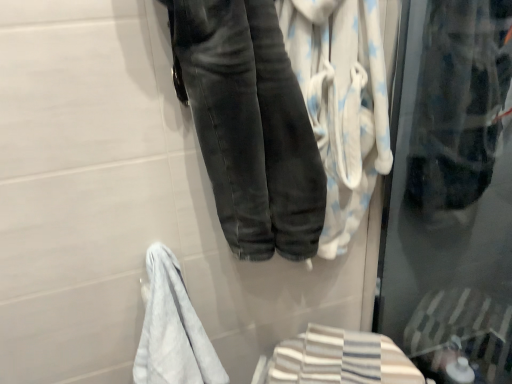
What do you see at coordinates (250, 126) in the screenshot?
I see `dark gray denim jeans at center` at bounding box center [250, 126].

This screenshot has width=512, height=384. What do you see at coordinates (342, 102) in the screenshot?
I see `white soft towel at center, the 1th bath towel viewed from the top` at bounding box center [342, 102].

Where is `striped cotton bath towel at lower right, the first bath towel in the bottom-to-top sequence`? striped cotton bath towel at lower right, the first bath towel in the bottom-to-top sequence is located at coordinates (327, 357).

Would you say dark gray denim jeans at center is a long distance from white soft towel at center, positioned as the 2th bath towel in bottom-to-top order?

No.

Consider the image. Considering the sizes of dark gray denim jeans at center and white soft towel at center, the 1th bath towel viewed from the top, in the image, is dark gray denim jeans at center bigger or smaller than white soft towel at center, the 1th bath towel viewed from the top,?

In the image, dark gray denim jeans at center appears to be larger than white soft towel at center, the 1th bath towel viewed from the top.

Is dark gray denim jeans at center oriented away from white soft towel at center, positioned as the 2th bath towel in bottom-to-top order?

dark gray denim jeans at center is not turned away from white soft towel at center, positioned as the 2th bath towel in bottom-to-top order.

Between dark gray denim jeans at center and white soft towel at center, the 1th bath towel viewed from the top, which one has less height?

Standing shorter between the two is dark gray denim jeans at center.

In the scene shown: From a real-world perspective, is dark gray denim jeans at center below white soft towel at lower left?

No, from a real-world perspective, dark gray denim jeans at center is not under white soft towel at lower left.

Can you confirm if dark gray denim jeans at center is bigger than white soft towel at lower left?

Correct, dark gray denim jeans at center is larger in size than white soft towel at lower left.

Does dark gray denim jeans at center turn towards white soft towel at lower left?

No, dark gray denim jeans at center is not facing towards white soft towel at lower left.

Is white soft towel at lower left next to dark gray denim jeans at center?

They are not placed beside each other.

From a real-world perspective, is white soft towel at lower left under dark gray denim jeans at center?

Indeed, from a real-world perspective, white soft towel at lower left is positioned beneath dark gray denim jeans at center.

Considering the relative sizes of white soft towel at lower left and dark gray denim jeans at center in the image provided, is white soft towel at lower left wider than dark gray denim jeans at center?

No, white soft towel at lower left is not wider than dark gray denim jeans at center.

What's the angular difference between white soft towel at lower left and dark gray denim jeans at center's facing directions?

They differ by 2.61 degrees in their facing directions.

Is striped cotton bath towel at lower right, the first bath towel in the bottom-to-top sequence, to the right of dark gray denim jeans at center from the viewer's perspective?

Yes.

Is dark gray denim jeans at center at the back of striped cotton bath towel at lower right, the first bath towel in the bottom-to-top sequence?

No, striped cotton bath towel at lower right, the first bath towel in the bottom-to-top sequence, is not facing the opposite direction of dark gray denim jeans at center.

This screenshot has width=512, height=384. Find the location of `trousers that appears in front of the striped cotton bath towel at lower right, the first bath towel in the bottom-to-top sequence`. trousers that appears in front of the striped cotton bath towel at lower right, the first bath towel in the bottom-to-top sequence is located at coordinates (250, 126).

Considering the sizes of objects striped cotton bath towel at lower right, which ranks as the 2th bath towel in top-to-bottom order, and dark gray denim jeans at center in the image provided, who is taller, striped cotton bath towel at lower right, which ranks as the 2th bath towel in top-to-bottom order, or dark gray denim jeans at center?

With more height is dark gray denim jeans at center.

Which bath towel is the 1st one when counting from the right side of the dark gray denim jeans at center? Please provide its 2D coordinates.

[(342, 102)]

Is point (297, 67) positioned after point (239, 29)?

That is True.

How distant is white soft towel at center, the 1th bath towel viewed from the top, from dark gray denim jeans at center?

The distance of white soft towel at center, the 1th bath towel viewed from the top, from dark gray denim jeans at center is 5.90 inches.

Is white soft towel at center, positioned as the 2th bath towel in bottom-to-top order, looking in the opposite direction of dark gray denim jeans at center?

white soft towel at center, positioned as the 2th bath towel in bottom-to-top order, does not have its back to dark gray denim jeans at center.

Is striped cotton bath towel at lower right, which ranks as the 2th bath towel in top-to-bottom order, situated inside white soft towel at lower left or outside?

The correct answer is: outside.

Based on the photo, does striped cotton bath towel at lower right, the first bath towel in the bottom-to-top sequence, come behind white soft towel at lower left?

Yes, the depth of striped cotton bath towel at lower right, the first bath towel in the bottom-to-top sequence, is greater than that of white soft towel at lower left.

Is striped cotton bath towel at lower right, the first bath towel in the bottom-to-top sequence, in contact with white soft towel at lower left?

No.

From the image's perspective, is white soft towel at center, positioned as the 2th bath towel in bottom-to-top order, positioned above or below striped cotton bath towel at lower right, the first bath towel in the bottom-to-top sequence?

white soft towel at center, positioned as the 2th bath towel in bottom-to-top order, is above striped cotton bath towel at lower right, the first bath towel in the bottom-to-top sequence.

Are white soft towel at center, positioned as the 2th bath towel in bottom-to-top order, and striped cotton bath towel at lower right, which ranks as the 2th bath towel in top-to-bottom order, beside each other?

No, white soft towel at center, positioned as the 2th bath towel in bottom-to-top order, is not making contact with striped cotton bath towel at lower right, which ranks as the 2th bath towel in top-to-bottom order.

From a real-world perspective, is white soft towel at center, positioned as the 2th bath towel in bottom-to-top order, physically above striped cotton bath towel at lower right, which ranks as the 2th bath towel in top-to-bottom order?

Indeed, from a real-world perspective, white soft towel at center, positioned as the 2th bath towel in bottom-to-top order, stands above striped cotton bath towel at lower right, which ranks as the 2th bath towel in top-to-bottom order.

Which object is wider, white soft towel at center, positioned as the 2th bath towel in bottom-to-top order, or striped cotton bath towel at lower right, the first bath towel in the bottom-to-top sequence?

Wider between the two is striped cotton bath towel at lower right, the first bath towel in the bottom-to-top sequence.

Starting from the dark gray denim jeans at center, which bath towel is the 1st one to the right? Please provide its 2D coordinates.

[(342, 102)]

Locate an element on the screen. trousers that appears above the white soft towel at lower left (from a real-world perspective) is located at coordinates (250, 126).

Considering their positions, is transparent plastic bag at upper right positioned closer to white soft towel at center, positioned as the 2th bath towel in bottom-to-top order, than white soft towel at lower left?

transparent plastic bag at upper right lies closer to white soft towel at center, positioned as the 2th bath towel in bottom-to-top order, than the other object.

Looking at the image, which one is located closer to striped cotton bath towel at lower right, which ranks as the 2th bath towel in top-to-bottom order, white soft towel at lower left or transparent plastic bag at upper right?

white soft towel at lower left lies closer to striped cotton bath towel at lower right, which ranks as the 2th bath towel in top-to-bottom order, than the other object.

Estimate the real-world distances between objects in this image. Which object is further from white soft towel at lower left, white soft towel at center, the 1th bath towel viewed from the top, or dark gray denim jeans at center?

Based on the image, white soft towel at center, the 1th bath towel viewed from the top, appears to be further to white soft towel at lower left.

Consider the image. Looking at the image, which one is located further to dark gray denim jeans at center, white soft towel at center, the 1th bath towel viewed from the top, or striped cotton bath towel at lower right, which ranks as the 2th bath towel in top-to-bottom order?

striped cotton bath towel at lower right, which ranks as the 2th bath towel in top-to-bottom order, is positioned further to the anchor dark gray denim jeans at center.

Considering their positions, is white soft towel at center, positioned as the 2th bath towel in bottom-to-top order, positioned closer to dark gray denim jeans at center than white soft towel at lower left?

The object closer to dark gray denim jeans at center is white soft towel at center, positioned as the 2th bath towel in bottom-to-top order.

Looking at the image, which one is located further to white soft towel at center, the 1th bath towel viewed from the top, dark gray denim jeans at center or striped cotton bath towel at lower right, the first bath towel in the bottom-to-top sequence?

Among the two, striped cotton bath towel at lower right, the first bath towel in the bottom-to-top sequence, is located further to white soft towel at center, the 1th bath towel viewed from the top.

Based on their spatial positions, is dark gray denim jeans at center or white soft towel at lower left further from striped cotton bath towel at lower right, the first bath towel in the bottom-to-top sequence?

dark gray denim jeans at center is positioned further to the anchor striped cotton bath towel at lower right, the first bath towel in the bottom-to-top sequence.

From the image, which object appears to be nearer to striped cotton bath towel at lower right, which ranks as the 2th bath towel in top-to-bottom order, transparent plastic bag at upper right or white soft towel at center, positioned as the 2th bath towel in bottom-to-top order?

transparent plastic bag at upper right is positioned closer to the anchor striped cotton bath towel at lower right, which ranks as the 2th bath towel in top-to-bottom order.

I want to click on bath towel between transparent plastic bag at upper right and striped cotton bath towel at lower right, which ranks as the 2th bath towel in top-to-bottom order, vertically, so click(x=342, y=102).

Locate an element on the screen. This screenshot has width=512, height=384. towel between dark gray denim jeans at center and striped cotton bath towel at lower right, which ranks as the 2th bath towel in top-to-bottom order, from top to bottom is located at coordinates point(173,330).

Where is `bath towel between dark gray denim jeans at center and white soft towel at lower left in the up-down direction`? The width and height of the screenshot is (512, 384). bath towel between dark gray denim jeans at center and white soft towel at lower left in the up-down direction is located at coordinates (342, 102).

This screenshot has width=512, height=384. What are the coordinates of `trousers situated between white soft towel at lower left and transparent plastic bag at upper right from left to right` in the screenshot? It's located at point(250,126).